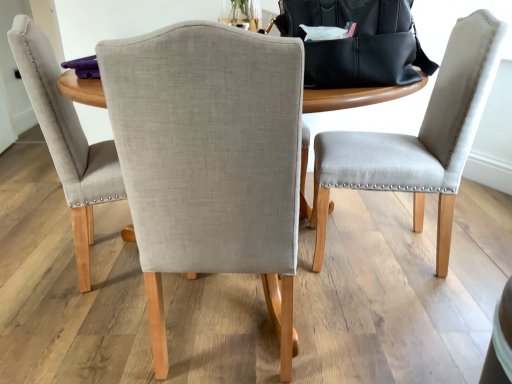
Image resolution: width=512 pixels, height=384 pixels. I want to click on light gray fabric chair at center, arranged as the 3th chair when viewed from the right, so click(x=66, y=139).

The image size is (512, 384). What are the coordinates of `black leather messenger bag at upper center` in the screenshot? It's located at (357, 43).

Can you tell me how much light gray fabric chair at center, placed as the second chair when sorted from left to right, and black leather messenger bag at upper center differ in facing direction?

There is a 3.8-degree angle between the facing directions of light gray fabric chair at center, placed as the second chair when sorted from left to right, and black leather messenger bag at upper center.

From a real-world perspective, is light gray fabric chair at center, the second chair in the right-to-left sequence, under black leather messenger bag at upper center?

Yes, from a real-world perspective, light gray fabric chair at center, the second chair in the right-to-left sequence, is beneath black leather messenger bag at upper center.

Which is closer to the camera, (194, 220) or (435, 67)?

Point (194, 220) appears to be closer to the viewer than point (435, 67).

Which object is positioned more to the right, light gray fabric chair at center, placed as the second chair when sorted from left to right, or black leather messenger bag at upper center?

black leather messenger bag at upper center.

Does point (197, 234) come farther from viewer compared to point (95, 186)?

No.

Does light gray fabric chair at center, placed as the second chair when sorted from left to right, have a lesser height compared to light gray fabric chair at center, arranged as the 3th chair when viewed from the right?

Yes.

The image size is (512, 384). I want to click on chair in front of the light gray fabric chair at center, the 1th chair viewed from the left, so click(x=210, y=160).

Is light gray fabric chair at center, the second chair in the right-to-left sequence, closer to the viewer compared to light gray fabric chair at center, the 1th chair viewed from the left?

Yes, light gray fabric chair at center, the second chair in the right-to-left sequence, is closer to the camera.

Would you say black leather messenger bag at upper center is inside or outside light gray fabric chair at center, the 1th chair viewed from the left?

The correct answer is: outside.

How different are the orientations of black leather messenger bag at upper center and light gray fabric chair at center, the 1th chair viewed from the left, in degrees?

64.4 degrees.

Considering the sizes of objects black leather messenger bag at upper center and light gray fabric chair at center, arranged as the 3th chair when viewed from the right, in the image provided, who is smaller, black leather messenger bag at upper center or light gray fabric chair at center, arranged as the 3th chair when viewed from the right,?

black leather messenger bag at upper center.

Where is `chair on the right of black leather messenger bag at upper center`? chair on the right of black leather messenger bag at upper center is located at coordinates (418, 139).

Would you consider matte gray chair at right, which is the 1th chair from right to left, to be distant from black leather messenger bag at upper center?

matte gray chair at right, which is the 1th chair from right to left, is near black leather messenger bag at upper center, not far away.

Can we say matte gray chair at right, which is the 1th chair from right to left, lies outside black leather messenger bag at upper center?

Yes, matte gray chair at right, which is the 1th chair from right to left, is outside of black leather messenger bag at upper center.

Is matte gray chair at right, which is the 1th chair from right to left, oriented away from black leather messenger bag at upper center?

No, black leather messenger bag at upper center is not at the back of matte gray chair at right, which is the 1th chair from right to left.

You are a GUI agent. You are given a task and a screenshot of the screen. Output one action in this format:
    pyautogui.click(x=<x>, y=<y>)
    Task: Click on the chair below the light gray fabric chair at center, placed as the second chair when sorted from left to right (from a real-world perspective)
    The width and height of the screenshot is (512, 384).
    Given the screenshot: What is the action you would take?
    pyautogui.click(x=418, y=139)

Is point (439, 82) positioned after point (185, 189)?

Yes, point (439, 82) is behind point (185, 189).

Which object is further away from the camera taking this photo, matte gray chair at right, which ranks as the third chair in left-to-right order, or light gray fabric chair at center, the second chair in the right-to-left sequence?

matte gray chair at right, which ranks as the third chair in left-to-right order, is further from the camera.

Is black leather messenger bag at upper center at the back of light gray fabric chair at center, arranged as the 3th chair when viewed from the right?

No, light gray fabric chair at center, arranged as the 3th chair when viewed from the right, is not facing away from black leather messenger bag at upper center.

Does light gray fabric chair at center, the 1th chair viewed from the left, have a greater width compared to black leather messenger bag at upper center?

Yes, light gray fabric chair at center, the 1th chair viewed from the left, is wider than black leather messenger bag at upper center.

There is a black leather messenger bag at upper center. Where is `the 1st chair below it (from a real-world perspective)`? The height and width of the screenshot is (384, 512). the 1st chair below it (from a real-world perspective) is located at coordinates (66, 139).

Would you say matte gray chair at right, which ranks as the third chair in left-to-right order, is outside light gray fabric chair at center, arranged as the 3th chair when viewed from the right?

Yes, matte gray chair at right, which ranks as the third chair in left-to-right order, is not within light gray fabric chair at center, arranged as the 3th chair when viewed from the right.

From a real-world perspective, is matte gray chair at right, which is the 1th chair from right to left, positioned above or below light gray fabric chair at center, arranged as the 3th chair when viewed from the right?

From a real-world perspective, matte gray chair at right, which is the 1th chair from right to left, is physically below light gray fabric chair at center, arranged as the 3th chair when viewed from the right.

Does matte gray chair at right, which ranks as the third chair in left-to-right order, have a lesser height compared to light gray fabric chair at center, arranged as the 3th chair when viewed from the right?

Correct, matte gray chair at right, which ranks as the third chair in left-to-right order, is not as tall as light gray fabric chair at center, arranged as the 3th chair when viewed from the right.

Can you confirm if matte gray chair at right, which is the 1th chair from right to left, is thinner than light gray fabric chair at center, the 1th chair viewed from the left?

Indeed, matte gray chair at right, which is the 1th chair from right to left, has a lesser width compared to light gray fabric chair at center, the 1th chair viewed from the left.

What are the coordinates of `chair in front of the black leather messenger bag at upper center` in the screenshot? It's located at (210, 160).

Locate an element on the screen. The image size is (512, 384). the 1st chair counting from the right side of the light gray fabric chair at center, the 1th chair viewed from the left is located at coordinates (210, 160).

In the scene shown: When comparing their distances from black leather messenger bag at upper center, does matte gray chair at right, which ranks as the third chair in left-to-right order, or light gray fabric chair at center, arranged as the 3th chair when viewed from the right, seem closer?

The object closer to black leather messenger bag at upper center is matte gray chair at right, which ranks as the third chair in left-to-right order.

When comparing their distances from light gray fabric chair at center, the 1th chair viewed from the left, does matte gray chair at right, which ranks as the third chair in left-to-right order, or light gray fabric chair at center, placed as the second chair when sorted from left to right, seem further?

The object further to light gray fabric chair at center, the 1th chair viewed from the left, is matte gray chair at right, which ranks as the third chair in left-to-right order.

Based on their spatial positions, is light gray fabric chair at center, placed as the second chair when sorted from left to right, or matte gray chair at right, which is the 1th chair from right to left, closer to black leather messenger bag at upper center?

Among the two, light gray fabric chair at center, placed as the second chair when sorted from left to right, is located nearer to black leather messenger bag at upper center.

Based on the photo, from the image, which object appears to be nearer to matte gray chair at right, which ranks as the third chair in left-to-right order, light gray fabric chair at center, the 1th chair viewed from the left, or black leather messenger bag at upper center?

black leather messenger bag at upper center is positioned closer to the anchor matte gray chair at right, which ranks as the third chair in left-to-right order.

Which object lies further to the anchor point matte gray chair at right, which ranks as the third chair in left-to-right order, black leather messenger bag at upper center or light gray fabric chair at center, the 1th chair viewed from the left?

Based on the image, light gray fabric chair at center, the 1th chair viewed from the left, appears to be further to matte gray chair at right, which ranks as the third chair in left-to-right order.

Based on their spatial positions, is light gray fabric chair at center, placed as the second chair when sorted from left to right, or matte gray chair at right, which ranks as the third chair in left-to-right order, further from light gray fabric chair at center, arranged as the 3th chair when viewed from the right?

The object further to light gray fabric chair at center, arranged as the 3th chair when viewed from the right, is matte gray chair at right, which ranks as the third chair in left-to-right order.

From the picture: Looking at the image, which one is located closer to light gray fabric chair at center, arranged as the 3th chair when viewed from the right, black leather messenger bag at upper center or light gray fabric chair at center, placed as the second chair when sorted from left to right?

light gray fabric chair at center, placed as the second chair when sorted from left to right.

Estimate the real-world distances between objects in this image. Which object is further from black leather messenger bag at upper center, matte gray chair at right, which is the 1th chair from right to left, or light gray fabric chair at center, the second chair in the right-to-left sequence?

matte gray chair at right, which is the 1th chair from right to left, lies further to black leather messenger bag at upper center than the other object.

You are a GUI agent. You are given a task and a screenshot of the screen. Output one action in this format:
    pyautogui.click(x=<x>, y=<y>)
    Task: Click on the messenger bag located between light gray fabric chair at center, the second chair in the right-to-left sequence, and matte gray chair at right, which is the 1th chair from right to left, in the left-right direction
    The image size is (512, 384).
    Given the screenshot: What is the action you would take?
    pyautogui.click(x=357, y=43)

Locate an element on the screen. messenger bag between light gray fabric chair at center, arranged as the 3th chair when viewed from the right, and matte gray chair at right, which is the 1th chair from right to left, from left to right is located at coordinates (357, 43).

The height and width of the screenshot is (384, 512). Find the location of `chair between light gray fabric chair at center, the 1th chair viewed from the left, and black leather messenger bag at upper center`. chair between light gray fabric chair at center, the 1th chair viewed from the left, and black leather messenger bag at upper center is located at coordinates tap(210, 160).

What are the coordinates of `chair located between light gray fabric chair at center, arranged as the 3th chair when viewed from the right, and matte gray chair at right, which is the 1th chair from right to left, in the left-right direction` in the screenshot? It's located at (210, 160).